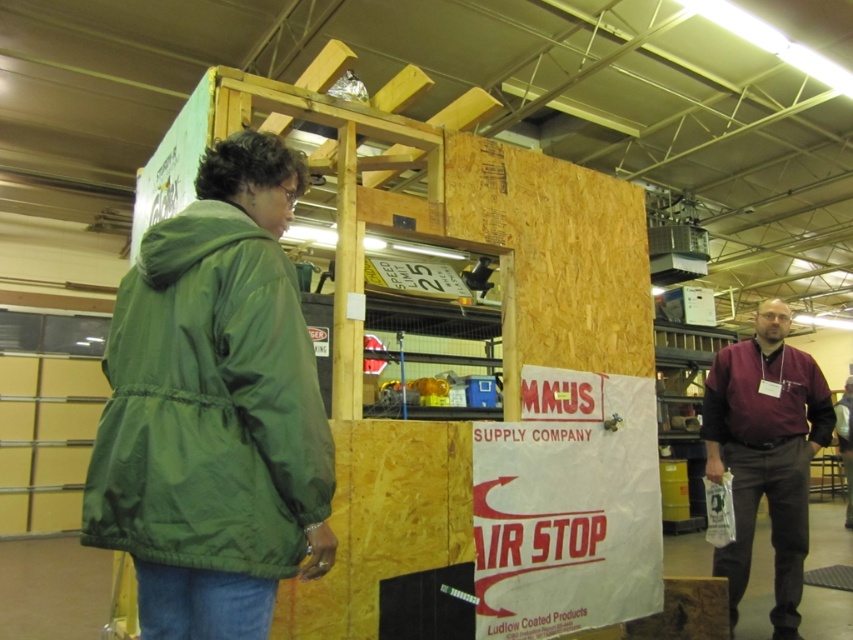
Question: Which point is farther to the camera?

Choices:
 (A) (793, 588)
 (B) (119, 512)

Answer: (A)

Question: Which object is closer to the camera taking this photo?

Choices:
 (A) green nylon jacket at left
 (B) white paper sign at center

Answer: (A)

Question: Is white paper sign at center to the left of maroon fabric shirt at right from the viewer's perspective?

Choices:
 (A) yes
 (B) no

Answer: (A)

Question: Which is farther from the green nylon jacket at left?

Choices:
 (A) white paper sign at center
 (B) maroon fabric shirt at right

Answer: (B)

Question: Observing the image, what is the correct spatial positioning of white paper sign at center in reference to maroon fabric shirt at right?

Choices:
 (A) below
 (B) above

Answer: (A)

Question: Can you confirm if white paper sign at center is thinner than maroon fabric shirt at right?

Choices:
 (A) no
 (B) yes

Answer: (A)